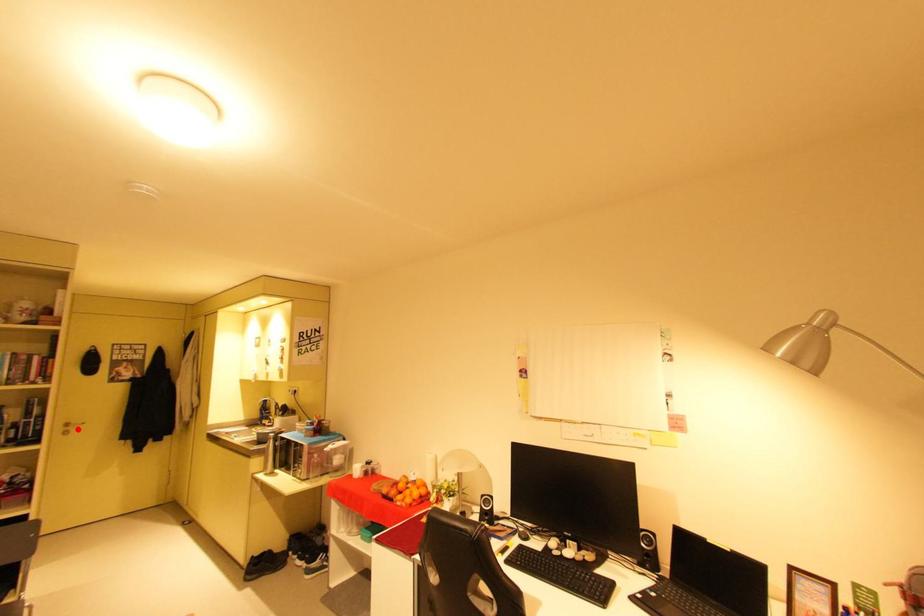
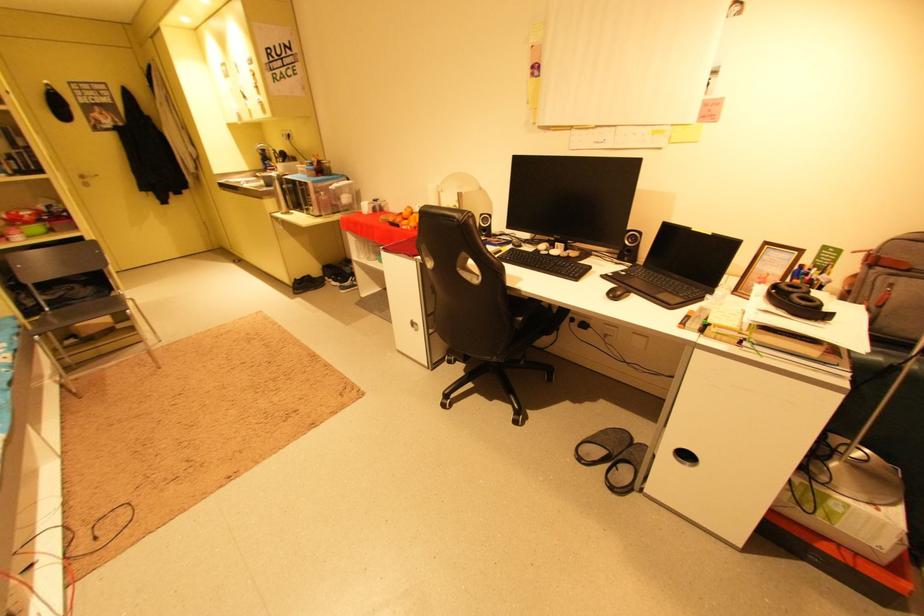
Locate, in the second image, the point that corresponds to the highlighted location in the first image.

(93, 180)